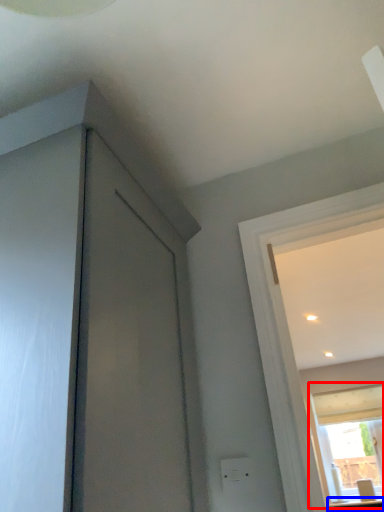
Question: Which of the following is the farthest to the observer, window (highlighted by a red box) or counter top (highlighted by a blue box)?

Choices:
 (A) window
 (B) counter top

Answer: (A)